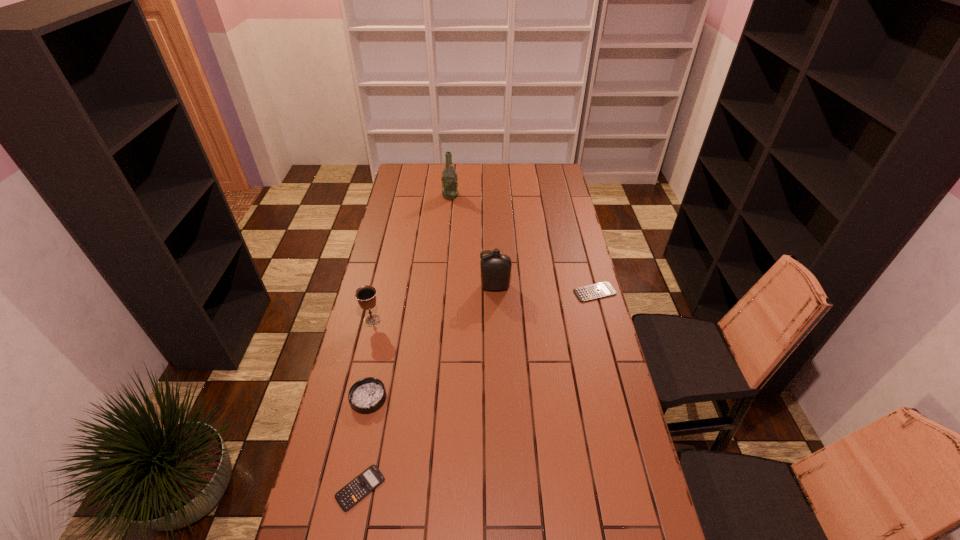
Please point a location where one more calculator can be added evenly. Please provide its 2D coordinates. Your answer should be formatted as a tuple, i.e. [(x, y)], where the tuple contains the x and y coordinates of a point satisfying the conditions above.

[(499, 372)]